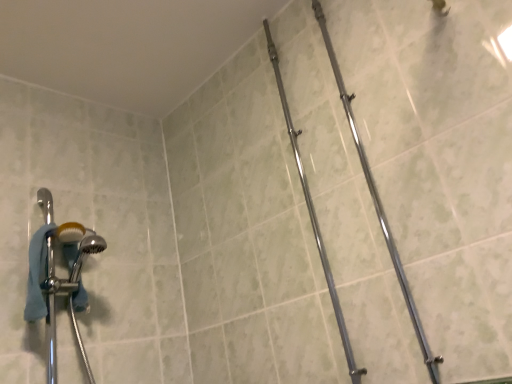
At what (x,y) coordinates should I click in order to perform the action: click on chrome/metallic pipe at center-right, placed as the first pipe when sorted from right to left. Please return your answer as a coordinate pair (x, y). Image resolution: width=512 pixels, height=384 pixels. Looking at the image, I should click on (378, 204).

The width and height of the screenshot is (512, 384). What do you see at coordinates (378, 204) in the screenshot?
I see `chrome/metallic pipe at center-right, which ranks as the 2th pipe in left-to-right order` at bounding box center [378, 204].

Based on the photo, how much space does chrome/metallic pipe at center-right, placed as the first pipe when sorted from right to left, occupy horizontally?

chrome/metallic pipe at center-right, placed as the first pipe when sorted from right to left, is 2.90 inches in width.

In order to click on polished chrome pipe at center, positioned as the second pipe in right-to-left order in this screenshot , I will do `click(313, 213)`.

Describe the element at coordinates (313, 213) in the screenshot. I see `polished chrome pipe at center, positioned as the second pipe in right-to-left order` at that location.

Consider the image. In order to face polished chrome pipe at center, positioned as the second pipe in right-to-left order, should I rotate leftwards or rightwards?

You should rotate right by 5.995 degrees.

Identify the location of chrome/metallic pipe at center-right, placed as the first pipe when sorted from right to left. (378, 204).

Consider the image. Which is more to the right, chrome/metallic pipe at center-right, placed as the first pipe when sorted from right to left, or polished chrome pipe at center, positioned as the second pipe in right-to-left order?

From the viewer's perspective, chrome/metallic pipe at center-right, placed as the first pipe when sorted from right to left, appears more on the right side.

Between chrome/metallic pipe at center-right, which ranks as the 2th pipe in left-to-right order, and polished chrome pipe at center, the 1th pipe in the left-to-right sequence, which one is positioned in front?

chrome/metallic pipe at center-right, which ranks as the 2th pipe in left-to-right order, is more forward.

Is point (383, 213) more distant than point (360, 377)?

Yes, point (383, 213) is behind point (360, 377).

From the image's perspective, is chrome/metallic pipe at center-right, which ranks as the 2th pipe in left-to-right order, beneath polished chrome pipe at center, the 1th pipe in the left-to-right sequence?

Actually, chrome/metallic pipe at center-right, which ranks as the 2th pipe in left-to-right order, appears above polished chrome pipe at center, the 1th pipe in the left-to-right sequence, in the image.

From a real-world perspective, is chrome/metallic pipe at center-right, which ranks as the 2th pipe in left-to-right order, physically above polished chrome pipe at center, positioned as the second pipe in right-to-left order?

No.

Is chrome/metallic pipe at center-right, placed as the first pipe when sorted from right to left, wider than polished chrome pipe at center, the 1th pipe in the left-to-right sequence?

Yes.

Considering the sizes of objects chrome/metallic pipe at center-right, placed as the first pipe when sorted from right to left, and polished chrome pipe at center, positioned as the second pipe in right-to-left order, in the image provided, who is shorter, chrome/metallic pipe at center-right, placed as the first pipe when sorted from right to left, or polished chrome pipe at center, positioned as the second pipe in right-to-left order,?

Standing shorter between the two is chrome/metallic pipe at center-right, placed as the first pipe when sorted from right to left.

Can you confirm if chrome/metallic pipe at center-right, placed as the first pipe when sorted from right to left, is smaller than polished chrome pipe at center, the 1th pipe in the left-to-right sequence?

Yes.

Do you think chrome/metallic pipe at center-right, placed as the first pipe when sorted from right to left, is within polished chrome pipe at center, positioned as the second pipe in right-to-left order, or outside of it?

chrome/metallic pipe at center-right, placed as the first pipe when sorted from right to left, is not enclosed by polished chrome pipe at center, positioned as the second pipe in right-to-left order.

Are chrome/metallic pipe at center-right, which ranks as the 2th pipe in left-to-right order, and polished chrome pipe at center, the 1th pipe in the left-to-right sequence, making contact?

No, chrome/metallic pipe at center-right, which ranks as the 2th pipe in left-to-right order, is not touching polished chrome pipe at center, the 1th pipe in the left-to-right sequence.

Is chrome/metallic pipe at center-right, placed as the first pipe when sorted from right to left, oriented towards polished chrome pipe at center, the 1th pipe in the left-to-right sequence?

No, chrome/metallic pipe at center-right, placed as the first pipe when sorted from right to left, is not turned towards polished chrome pipe at center, the 1th pipe in the left-to-right sequence.

How many degrees apart are the facing directions of chrome/metallic pipe at center-right, placed as the first pipe when sorted from right to left, and polished chrome pipe at center, positioned as the second pipe in right-to-left order?

chrome/metallic pipe at center-right, placed as the first pipe when sorted from right to left, and polished chrome pipe at center, positioned as the second pipe in right-to-left order, are facing 0.000732 degrees away from each other.

This screenshot has height=384, width=512. What are the coordinates of `pipe that appears below the polished chrome pipe at center, positioned as the second pipe in right-to-left order (from a real-world perspective)` in the screenshot? It's located at (378, 204).

Which is more to the left, polished chrome pipe at center, the 1th pipe in the left-to-right sequence, or chrome/metallic pipe at center-right, which ranks as the 2th pipe in left-to-right order?

Positioned to the left is polished chrome pipe at center, the 1th pipe in the left-to-right sequence.

Is polished chrome pipe at center, the 1th pipe in the left-to-right sequence, positioned in front of chrome/metallic pipe at center-right, placed as the first pipe when sorted from right to left?

No, polished chrome pipe at center, the 1th pipe in the left-to-right sequence, is further to the viewer.

Is point (308, 190) positioned behind point (375, 198)?

That is True.

From the image's perspective, which is below, polished chrome pipe at center, the 1th pipe in the left-to-right sequence, or chrome/metallic pipe at center-right, which ranks as the 2th pipe in left-to-right order?

polished chrome pipe at center, the 1th pipe in the left-to-right sequence, appears lower in the image.

From a real-world perspective, is polished chrome pipe at center, positioned as the second pipe in right-to-left order, positioned above or below chrome/metallic pipe at center-right, placed as the first pipe when sorted from right to left?

polished chrome pipe at center, positioned as the second pipe in right-to-left order, is situated higher than chrome/metallic pipe at center-right, placed as the first pipe when sorted from right to left, in the real world.

Considering the relative sizes of polished chrome pipe at center, positioned as the second pipe in right-to-left order, and chrome/metallic pipe at center-right, which ranks as the 2th pipe in left-to-right order, in the image provided, is polished chrome pipe at center, positioned as the second pipe in right-to-left order, thinner than chrome/metallic pipe at center-right, which ranks as the 2th pipe in left-to-right order,?

Correct, the width of polished chrome pipe at center, positioned as the second pipe in right-to-left order, is less than that of chrome/metallic pipe at center-right, which ranks as the 2th pipe in left-to-right order.

Considering the sizes of objects polished chrome pipe at center, the 1th pipe in the left-to-right sequence, and chrome/metallic pipe at center-right, which ranks as the 2th pipe in left-to-right order, in the image provided, who is shorter, polished chrome pipe at center, the 1th pipe in the left-to-right sequence, or chrome/metallic pipe at center-right, which ranks as the 2th pipe in left-to-right order,?

chrome/metallic pipe at center-right, which ranks as the 2th pipe in left-to-right order.

Looking at the image, does polished chrome pipe at center, positioned as the second pipe in right-to-left order, seem bigger or smaller compared to chrome/metallic pipe at center-right, placed as the first pipe when sorted from right to left?

Considering their sizes, polished chrome pipe at center, positioned as the second pipe in right-to-left order, takes up more space than chrome/metallic pipe at center-right, placed as the first pipe when sorted from right to left.

Do you think polished chrome pipe at center, the 1th pipe in the left-to-right sequence, is within chrome/metallic pipe at center-right, which ranks as the 2th pipe in left-to-right order, or outside of it?

polished chrome pipe at center, the 1th pipe in the left-to-right sequence, exists outside the volume of chrome/metallic pipe at center-right, which ranks as the 2th pipe in left-to-right order.

Would you consider polished chrome pipe at center, the 1th pipe in the left-to-right sequence, to be distant from chrome/metallic pipe at center-right, placed as the first pipe when sorted from right to left?

No, there isn't a large distance between polished chrome pipe at center, the 1th pipe in the left-to-right sequence, and chrome/metallic pipe at center-right, placed as the first pipe when sorted from right to left.

Is polished chrome pipe at center, the 1th pipe in the left-to-right sequence, facing away from chrome/metallic pipe at center-right, placed as the first pipe when sorted from right to left?

That's not correct — polished chrome pipe at center, the 1th pipe in the left-to-right sequence, is not looking away from chrome/metallic pipe at center-right, placed as the first pipe when sorted from right to left.

What's the angular difference between polished chrome pipe at center, positioned as the second pipe in right-to-left order, and chrome/metallic pipe at center-right, placed as the first pipe when sorted from right to left,'s facing directions?

The facing directions of polished chrome pipe at center, positioned as the second pipe in right-to-left order, and chrome/metallic pipe at center-right, placed as the first pipe when sorted from right to left, are 0.000732 degrees apart.

Locate an element on the screen. pipe lying behind the chrome/metallic pipe at center-right, placed as the first pipe when sorted from right to left is located at coordinates (313, 213).

This screenshot has height=384, width=512. I want to click on pipe to the left of chrome/metallic pipe at center-right, placed as the first pipe when sorted from right to left, so click(313, 213).

Locate an element on the screen. pipe located above the chrome/metallic pipe at center-right, which ranks as the 2th pipe in left-to-right order (from a real-world perspective) is located at coordinates (313, 213).